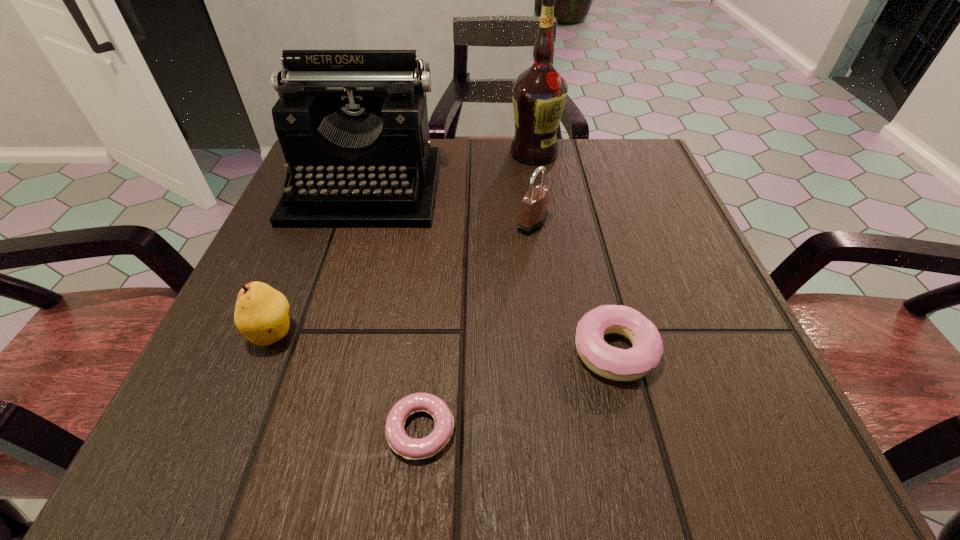
Identify the location of vacant space located on the left of the padlock. The height and width of the screenshot is (540, 960). (408, 224).

Where is `vacant space located 0.130m on the right of the fourth tallest object`? vacant space located 0.130m on the right of the fourth tallest object is located at coordinates click(x=388, y=333).

Find the location of a particular element. The height and width of the screenshot is (540, 960). free spot located on the right of the second shortest object is located at coordinates (727, 351).

This screenshot has width=960, height=540. Identify the location of free space located on the right of the nearer doughnut. (702, 430).

Identify the location of alcohol located at the far edge. The height and width of the screenshot is (540, 960). (539, 94).

I want to click on typewriter that is at the far edge, so click(353, 127).

The width and height of the screenshot is (960, 540). What are the coordinates of `object that is at the near edge` in the screenshot? It's located at (410, 448).

Locate an element on the screen. This screenshot has height=540, width=960. typewriter that is at the left edge is located at coordinates (353, 127).

Identify the location of pear that is at the left edge. (261, 314).

Where is `object that is at the right edge`? object that is at the right edge is located at coordinates (613, 363).